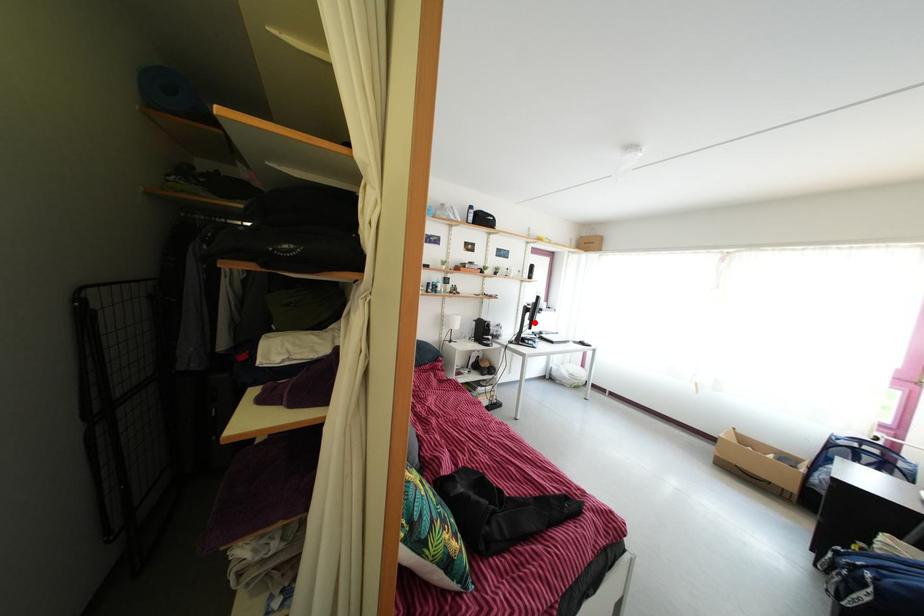
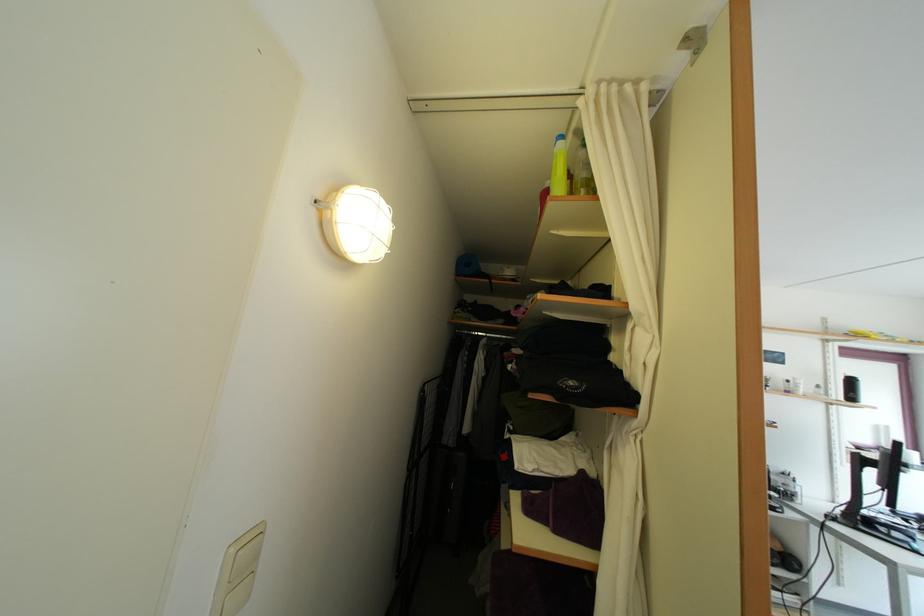
Question: I am providing you with two images of the same scene from different viewpoints. A red point is shown in image1. For the corresponding object point in image2, is it positioned nearer or farther from the camera?

Choices:
 (A) Nearer
 (B) Farther

Answer: (A)